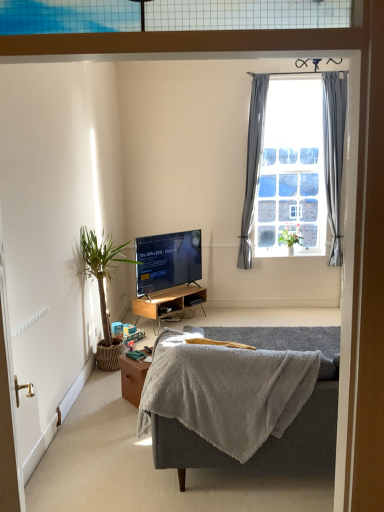
Question: From a real-world perspective, relative to gray plush couch at center, is brown wooden table at lower center vertically above or below?

Choices:
 (A) above
 (B) below

Answer: (B)

Question: Considering the positions of brown wooden table at lower center and gray plush couch at center in the image, is brown wooden table at lower center bigger or smaller than gray plush couch at center?

Choices:
 (A) small
 (B) big

Answer: (A)

Question: Estimate the real-world distances between objects in this image. Which object is closer to the gray fabric curtain at right, which appears as the second curtain when viewed from the right?

Choices:
 (A) matte black tv at center
 (B) green leafy plant at left, positioned as the 2th houseplant in back-to-front order
 (C) clear glass window at upper right
 (D) green leafy plant at window, positioned as the first houseplant in back-to-front order
 (E) gray plush couch at center

Answer: (C)

Question: Which of these objects is positioned farthest from the gray fabric curtain at upper right, which is counted as the second curtain, starting from the left?

Choices:
 (A) matte black tv at center
 (B) woodenmaterial/texturedesk at center
 (C) green leafy plant at window, positioned as the first houseplant in back-to-front order
 (D) brown wooden table at lower center
 (E) green leafy plant at left, the 2th houseplant viewed from the right

Answer: (D)